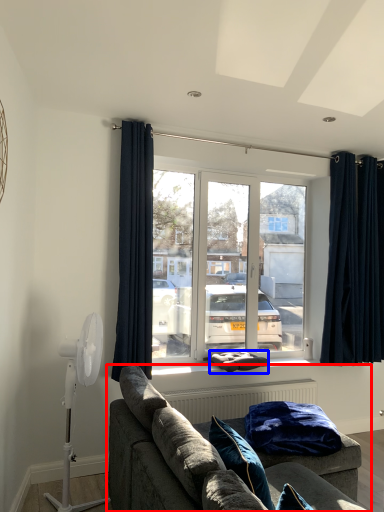
Question: Which of the following is the closest to the observer, studio couch (highlighted by a red box) or pillow (highlighted by a blue box)?

Choices:
 (A) studio couch
 (B) pillow

Answer: (A)